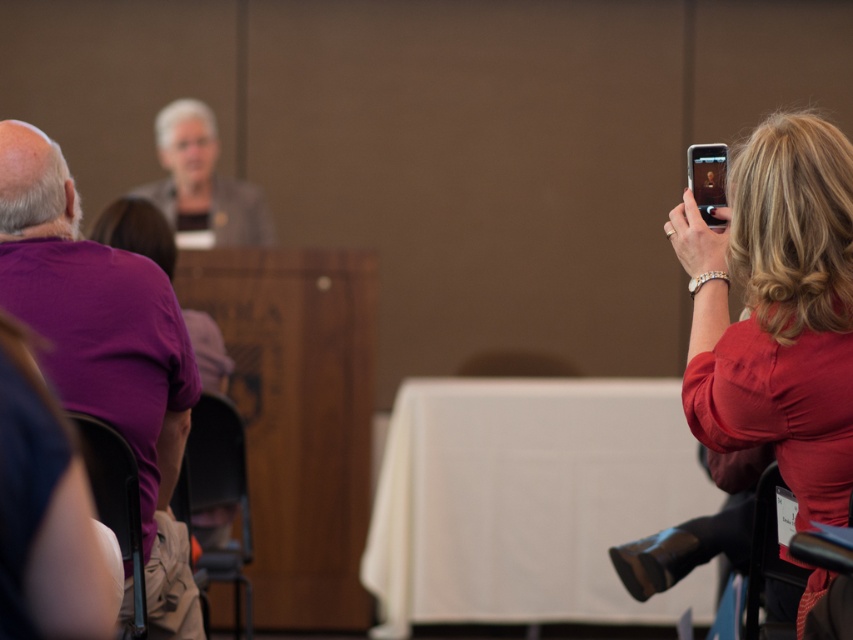
You are a photographer positioned at the front of the conference room. You need to capture a photo that includes both the purple cotton shirt at left and the matte gray blazer at center. Given that your camera has a maximum focus range of 3 meters, will you be able to include both subjects in the same frame without moving your position?

The purple cotton shirt at left is 3.69 meters away from the matte gray blazer at center. Since the camera can only focus up to 3 meters, the distance between them exceeds the maximum focus range. Therefore, you cannot include both subjects in the same frame without moving.

You are standing at the center of the room and want to take a photo of the matte red shirt at right. In which direction should you move to get a better view of it?

Since the matte red shirt at right is located at point 0.484 on the x and 0.911 on the y, you should move to your right to get a better view of it.

You are standing at the back of the room and want to take a photo of the person at the podium. There are two points marked in the scene. One is at coordinates point (814, 188) and the other is point (189, 99). Which point should you avoid standing behind to ensure you have an unobstructed view of the podium speaker?

You should avoid standing behind point (814, 188) because it is in front of point (189, 99). Being behind the more forward point would block your view of the podium speaker.